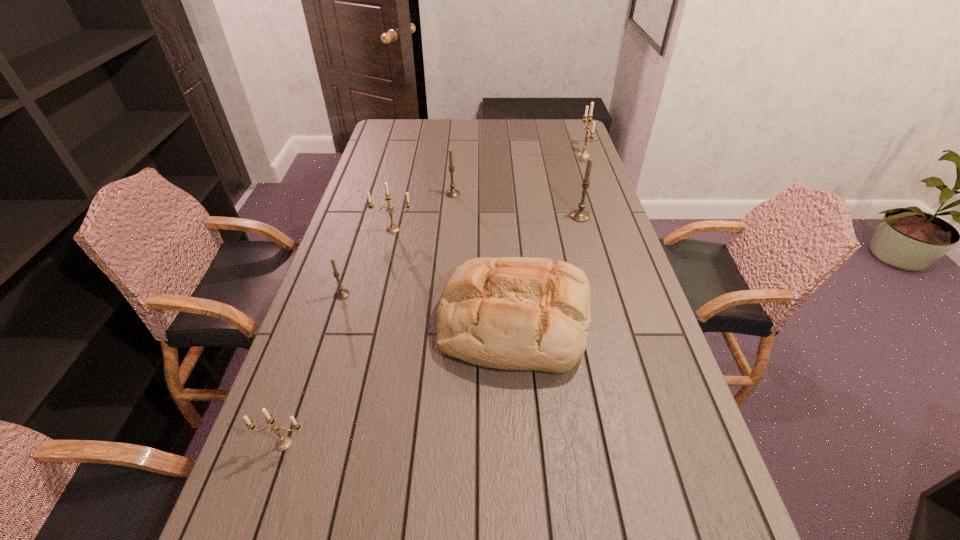
In order to click on the farthest candle in this screenshot , I will do `click(584, 154)`.

Locate an element on the screen. This screenshot has height=540, width=960. the rightmost candle is located at coordinates (584, 154).

Find the location of a particular element. the third farthest object is located at coordinates (580, 215).

Where is `the rightmost gray candle`? The image size is (960, 540). the rightmost gray candle is located at coordinates (580, 215).

The width and height of the screenshot is (960, 540). I want to click on the second farthest object, so click(452, 192).

The height and width of the screenshot is (540, 960). Identify the location of the second smallest gray candle. (452, 192).

Where is `the fourth farthest object`? Image resolution: width=960 pixels, height=540 pixels. the fourth farthest object is located at coordinates (393, 228).

Locate an element on the screen. the second farthest metallic candle is located at coordinates (393, 228).

Identify the location of bread. Image resolution: width=960 pixels, height=540 pixels. (513, 313).

At what (x,y) coordinates should I click in order to perform the action: click on the smallest gray candle. Please return your answer as a coordinate pair (x, y). The height and width of the screenshot is (540, 960). Looking at the image, I should click on (342, 293).